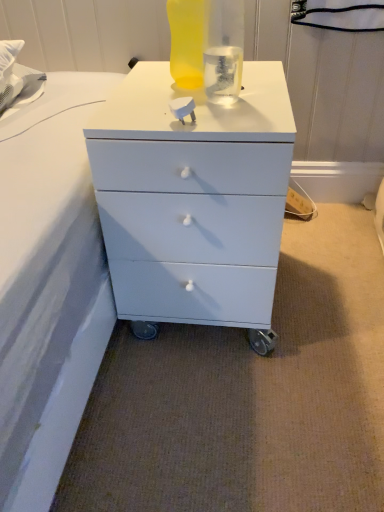
Question: Considering the relative sizes of white matte chest of drawers at center and translucent yellow bottle at upper center in the image provided, is white matte chest of drawers at center shorter than translucent yellow bottle at upper center?

Choices:
 (A) yes
 (B) no

Answer: (B)

Question: Can you confirm if white matte chest of drawers at center is bigger than translucent yellow bottle at upper center?

Choices:
 (A) yes
 (B) no

Answer: (A)

Question: Is white matte chest of drawers at center at the right side of translucent yellow bottle at upper center?

Choices:
 (A) yes
 (B) no

Answer: (A)

Question: Can you confirm if white matte chest of drawers at center is thinner than translucent yellow bottle at upper center?

Choices:
 (A) yes
 (B) no

Answer: (B)

Question: Is white matte chest of drawers at center touching translucent yellow bottle at upper center?

Choices:
 (A) yes
 (B) no

Answer: (B)

Question: From a real-world perspective, is white matte chest of drawers at center positioned over translucent yellow bottle at upper center based on gravity?

Choices:
 (A) yes
 (B) no

Answer: (B)

Question: Is translucent yellow bottle at upper center oriented towards white matte chest of drawers at center?

Choices:
 (A) yes
 (B) no

Answer: (B)

Question: Can you confirm if translucent yellow bottle at upper center is positioned to the right of white matte chest of drawers at center?

Choices:
 (A) yes
 (B) no

Answer: (B)

Question: Would you say translucent yellow bottle at upper center contains white matte chest of drawers at center?

Choices:
 (A) yes
 (B) no

Answer: (B)

Question: From a real-world perspective, is translucent yellow bottle at upper center located higher than white matte chest of drawers at center?

Choices:
 (A) no
 (B) yes

Answer: (B)

Question: Is translucent yellow bottle at upper center at the left side of white matte chest of drawers at center?

Choices:
 (A) yes
 (B) no

Answer: (A)

Question: Is translucent yellow bottle at upper center outside of white matte chest of drawers at center?

Choices:
 (A) yes
 (B) no

Answer: (A)

Question: Considering the positions of point (263, 101) and point (173, 10), is point (263, 101) closer or farther from the camera than point (173, 10)?

Choices:
 (A) closer
 (B) farther

Answer: (A)